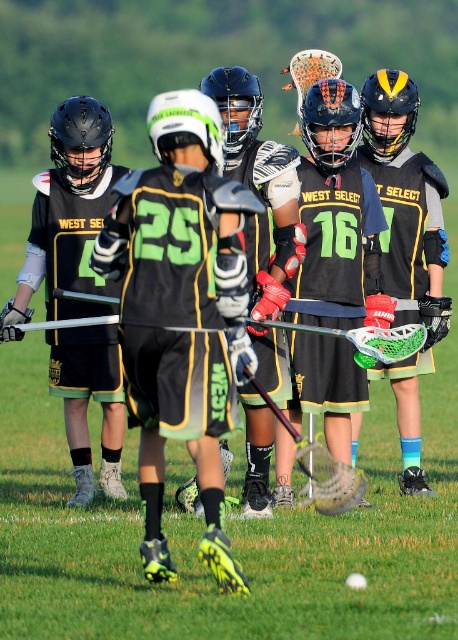
Question: Which object is closer to the camera taking this photo?

Choices:
 (A) matte black helmet at center
 (B) black matte lacrosse stick at center

Answer: (B)

Question: Does black matte lacrosse stick at center have a lesser width compared to matte black helmet at center?

Choices:
 (A) no
 (B) yes

Answer: (A)

Question: Is black matte lacrosse stick at center positioned before matte black helmet at center?

Choices:
 (A) yes
 (B) no

Answer: (A)

Question: Which object appears closest to the camera in this image?

Choices:
 (A) black matte lacrosse stick at center
 (B) matte black helmet at center

Answer: (A)

Question: Does black matte lacrosse stick at center come behind matte black helmet at center?

Choices:
 (A) yes
 (B) no

Answer: (B)